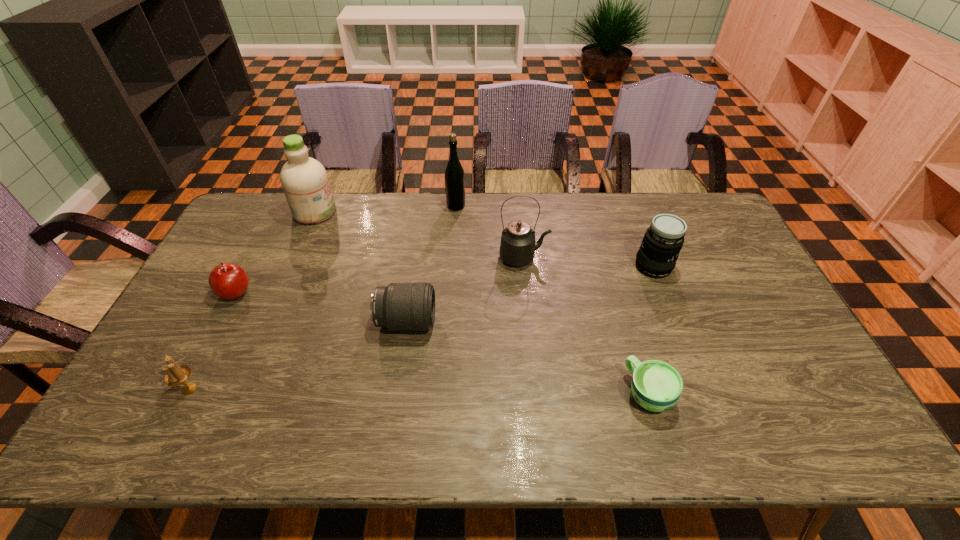
Where is `the second object from right to left`? This screenshot has width=960, height=540. the second object from right to left is located at coordinates (656, 386).

The image size is (960, 540). What are the coordinates of `cup` in the screenshot? It's located at (656, 386).

In order to click on vacant space located 0.300m on the front label of the cleansing agent in this screenshot , I will do `click(419, 212)`.

This screenshot has height=540, width=960. Find the location of `free spot located 0.060m on the left of the fourth object from right to left`. free spot located 0.060m on the left of the fourth object from right to left is located at coordinates (430, 206).

Locate an element on the screen. The image size is (960, 540). blank area located spout on the kettle is located at coordinates (622, 258).

Where is `free space located 0.090m on the front of the rightmost object`? Image resolution: width=960 pixels, height=540 pixels. free space located 0.090m on the front of the rightmost object is located at coordinates (667, 302).

This screenshot has width=960, height=540. I want to click on blank area located on the back of the candle holder, so click(x=234, y=301).

Find the location of `free space located on the surface of the left telephoto lens`. free space located on the surface of the left telephoto lens is located at coordinates (513, 322).

You are a GUI agent. You are given a task and a screenshot of the screen. Output one action in this format:
    pyautogui.click(x=<x>, y=<y>)
    Task: Click on the vacant area situated on the right of the apple
    
    Given the screenshot: What is the action you would take?
    pyautogui.click(x=340, y=293)

Where is `free spot located 0.050m on the back of the seventh object from left to right`? This screenshot has height=540, width=960. free spot located 0.050m on the back of the seventh object from left to right is located at coordinates (636, 353).